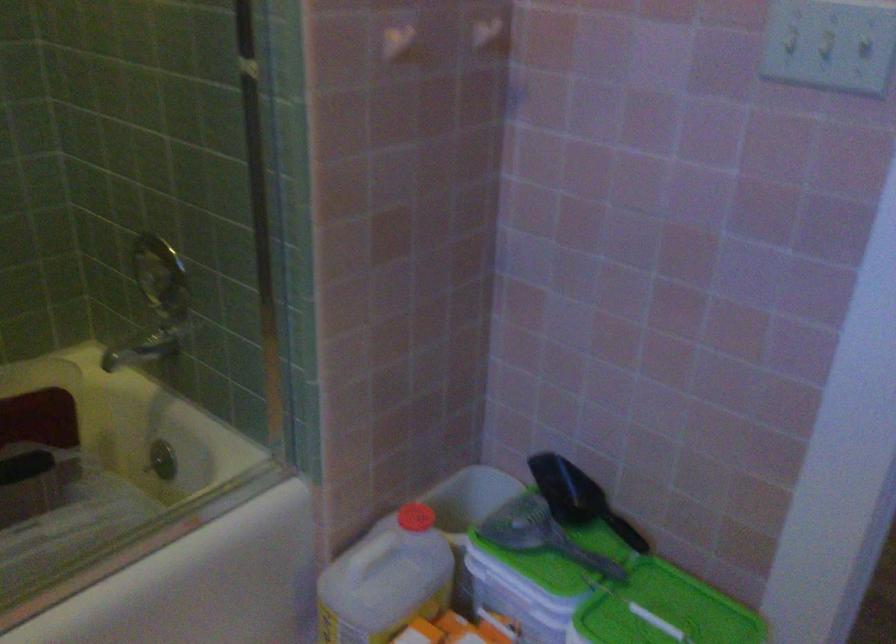
You are a GUI agent. You are given a task and a screenshot of the screen. Output one action in this format:
    pyautogui.click(x=<x>, y=<y>)
    Task: Click on the black scoop handle
    The image size is (896, 644).
    Given the screenshot: What is the action you would take?
    pyautogui.click(x=578, y=498)